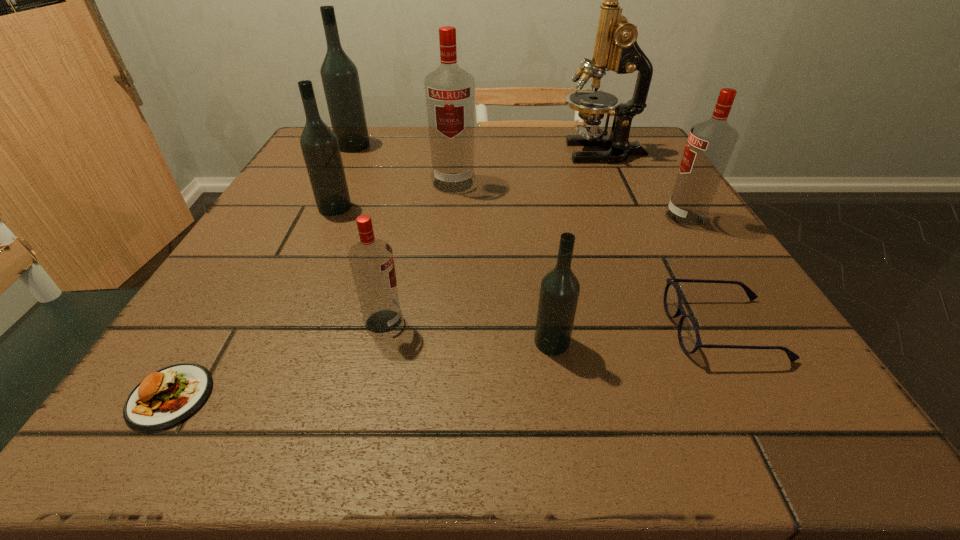
Identify which red vodka is the third closest to the spectacles. Please provide its 2D coordinates. Your answer should be formatted as a tuple, i.e. [(x, y)], where the tuple contains the x and y coordinates of a point satisfying the conditions above.

[(450, 91)]

Identify the location of free space that satisfies the following two spatial constraints: 1. on the front side of the biggest black vodka; 2. on the left side of the second nearest black vodka. (323, 207).

The height and width of the screenshot is (540, 960). I want to click on vacant space that satisfies the following two spatial constraints: 1. on the front label of the second farthest vodka; 2. on the front label of the fourth object from left to right, so click(441, 322).